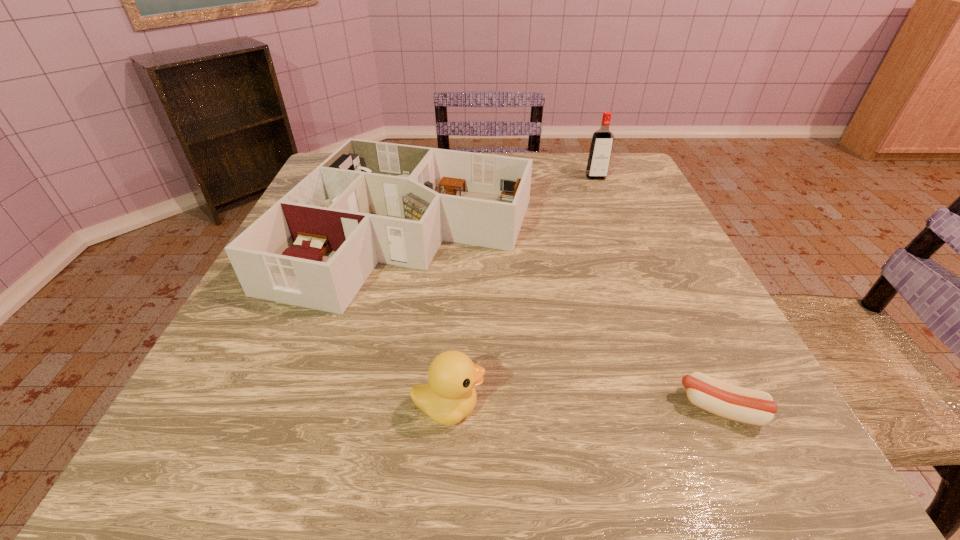
Where is `vacant area that lies between the duck and the shortest object`? vacant area that lies between the duck and the shortest object is located at coordinates (585, 408).

Identify which object is the second closest to the duck. Please provide its 2D coordinates. Your answer should be formatted as a tuple, i.e. [(x, y)], where the tuple contains the x and y coordinates of a point satisfying the conditions above.

[(741, 404)]

The image size is (960, 540). I want to click on object that stands as the closest to the duck, so click(x=369, y=202).

The width and height of the screenshot is (960, 540). I want to click on free space that satisfies the following two spatial constraints: 1. on the front and back of the vodka; 2. on the face of the duck, so click(689, 407).

Where is `vacant space that satisfies the following two spatial constraints: 1. on the front and back of the vodka; 2. on the face of the duck`? The width and height of the screenshot is (960, 540). vacant space that satisfies the following two spatial constraints: 1. on the front and back of the vodka; 2. on the face of the duck is located at coordinates (689, 407).

Where is `free location that satisfies the following two spatial constraints: 1. on the front and back of the shortest object; 2. on the left side of the tallest object`? The image size is (960, 540). free location that satisfies the following two spatial constraints: 1. on the front and back of the shortest object; 2. on the left side of the tallest object is located at coordinates (689, 408).

Find the location of a particular element. The height and width of the screenshot is (540, 960). free space that satisfies the following two spatial constraints: 1. on the front and back of the vodka; 2. on the face of the duck is located at coordinates (689, 407).

Where is `vacant space that satisfies the following two spatial constraints: 1. on the front and back of the tallest object; 2. on the face of the duck`? The height and width of the screenshot is (540, 960). vacant space that satisfies the following two spatial constraints: 1. on the front and back of the tallest object; 2. on the face of the duck is located at coordinates (x=689, y=407).

Where is `free space that satisfies the following two spatial constraints: 1. on the front and back of the tallest object; 2. on the face of the duck`? This screenshot has height=540, width=960. free space that satisfies the following two spatial constraints: 1. on the front and back of the tallest object; 2. on the face of the duck is located at coordinates coord(689,407).

At what (x,y) coordinates should I click in order to perform the action: click on blank space that satisfies the following two spatial constraints: 1. on the face of the shortest object; 2. on the right side of the duck. Please return your answer as a coordinate pair (x, y). The image size is (960, 540). Looking at the image, I should click on (448, 408).